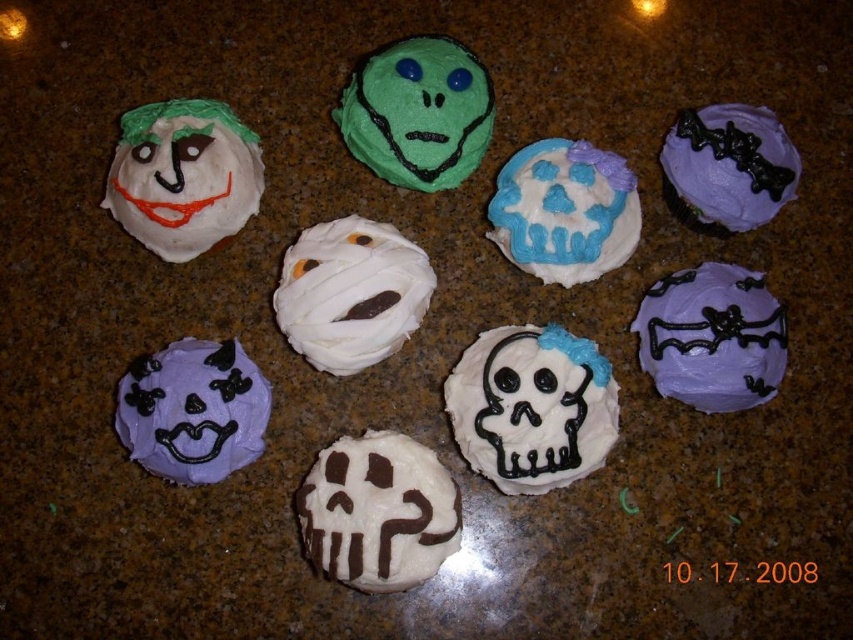
Question: Is purple matte skull at center-right thinner than blue glossy skull at center?

Choices:
 (A) yes
 (B) no

Answer: (A)

Question: Is matte white cupcake at upper left positioned behind purple matte skull at center?

Choices:
 (A) yes
 (B) no

Answer: (A)

Question: Which point is farther to the camera?

Choices:
 (A) (367, 586)
 (B) (123, 189)
 (C) (503, 339)
 (D) (299, 288)

Answer: (B)

Question: Which point appears farthest from the camera in this image?

Choices:
 (A) (210, 371)
 (B) (753, 330)
 (C) (183, 138)
 (D) (711, 160)

Answer: (C)

Question: Which object appears farthest from the camera in this image?

Choices:
 (A) white matte skull at center
 (B) matte white cupcake at upper left

Answer: (B)

Question: Does purple matte skull at center-right have a greater width compared to white matte skull at center?

Choices:
 (A) no
 (B) yes

Answer: (B)